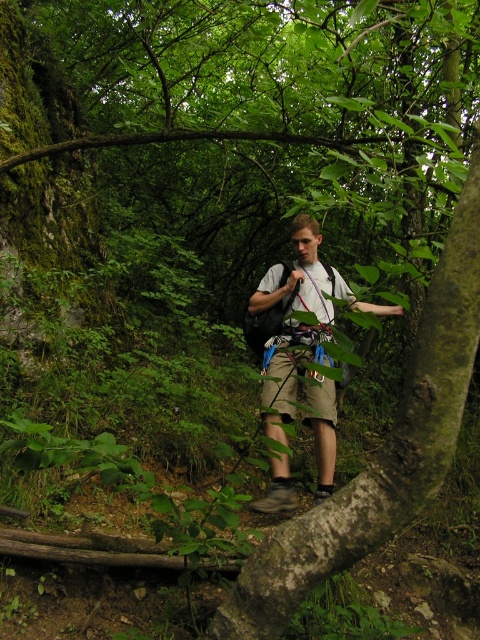
You are a hiker trying to decide whether to climb the green rough bark tree trunk at center using your light gray fabric backpack at center as an anchor. Based on their heights, is the tree trunk tall enough to allow a safe climb?

The green rough bark tree trunk at center is shorter than the light gray fabric backpack at center, which is impossible since the backpack is much smaller. Therefore, the tree trunk is not tall enough for a safe climb.

You are a hiker who wants to climb the green rough bark tree trunk at center. You have a light gray fabric backpack at center. Can you reach the tree trunk without removing the backpack?

The green rough bark tree trunk at center is located below the light gray fabric backpack at center, so you can reach the tree trunk without removing the backpack because it is positioned beneath the backpack.

You are a hiker standing at the entrance of the forest tunnel formed by the branches. You see the green rough bark tree trunk at center in front of you. If your hiking pole is 3 feet long, can you touch the tree trunk with it without moving closer?

The distance between you and the green rough bark tree trunk at center is 5.67 feet. Since your hiking pole is only 3 feet long, you cannot reach the tree trunk without moving closer.